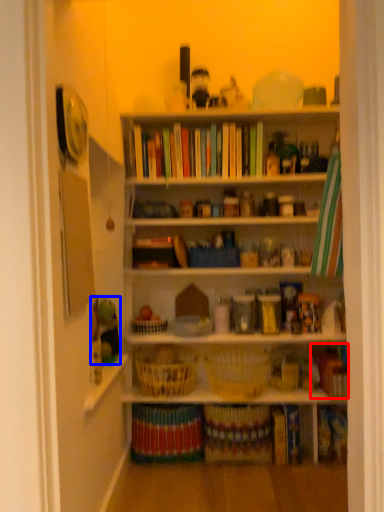
Question: Among these objects, which one is farthest to the camera, book (highlighted by a red box) or toy (highlighted by a blue box)?

Choices:
 (A) book
 (B) toy

Answer: (B)